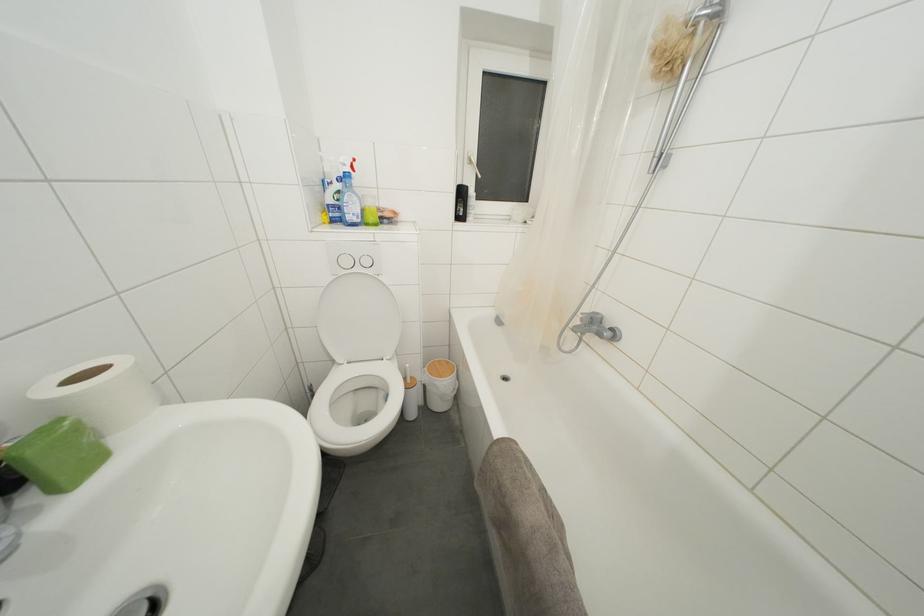
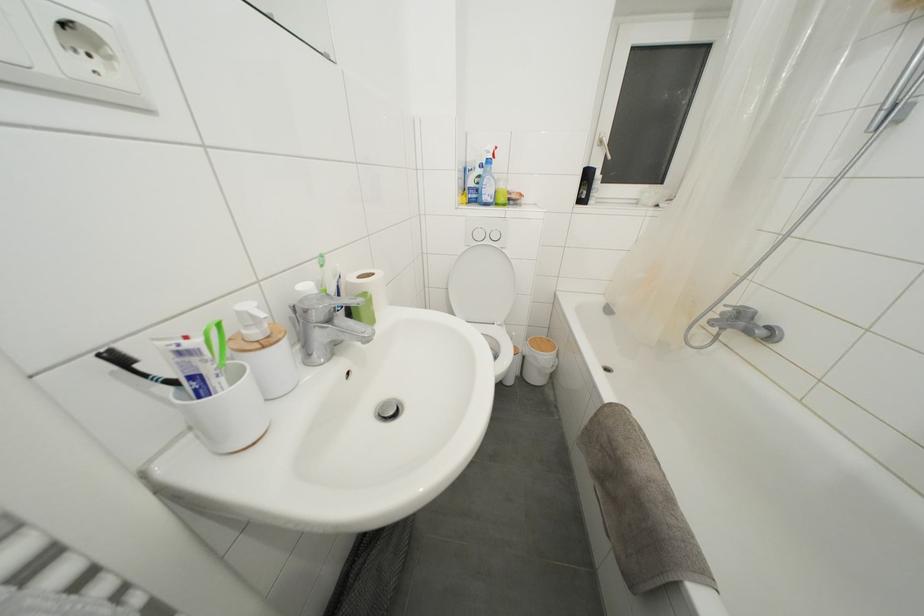
Find the pixel in the second image that matches [379,283] in the first image.

(505, 256)